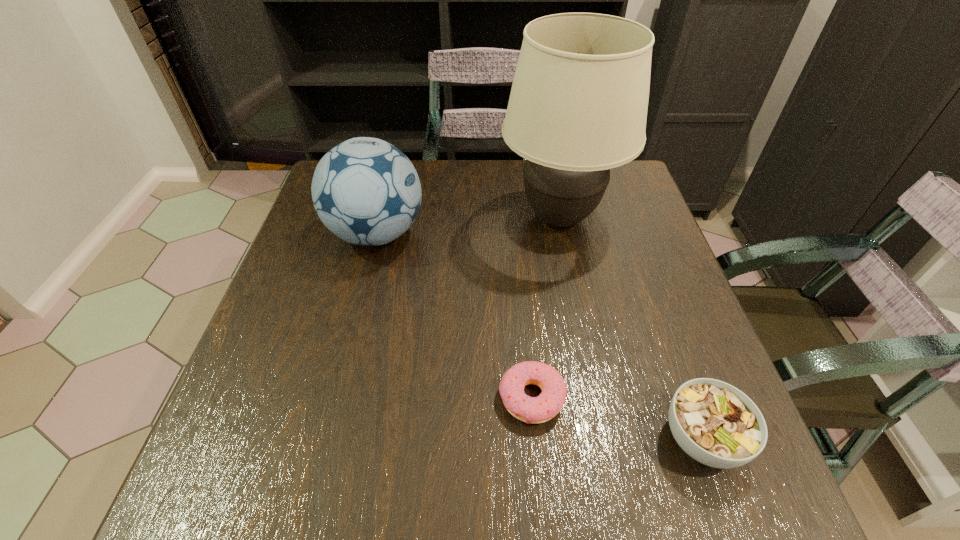
Where is `soccer ball present at the far edge`? The image size is (960, 540). soccer ball present at the far edge is located at coordinates (366, 191).

The width and height of the screenshot is (960, 540). I want to click on object positioned at the near edge, so click(715, 423).

In order to click on object that is positioned at the left edge in this screenshot , I will do `click(366, 191)`.

This screenshot has width=960, height=540. I want to click on lampshade that is at the right edge, so click(578, 105).

Locate an element on the screen. The height and width of the screenshot is (540, 960). soup bowl that is positioned at the right edge is located at coordinates (715, 423).

Where is `object present at the far left corner`? The image size is (960, 540). object present at the far left corner is located at coordinates (366, 191).

Find the location of a particular element. object located at the far right corner is located at coordinates (578, 105).

I want to click on object at the near right corner, so click(715, 423).

Image resolution: width=960 pixels, height=540 pixels. What are the coordinates of `vacant area at the far edge` in the screenshot? It's located at (480, 197).

Where is `vacant space at the near edge`? The image size is (960, 540). vacant space at the near edge is located at coordinates [x=572, y=487].